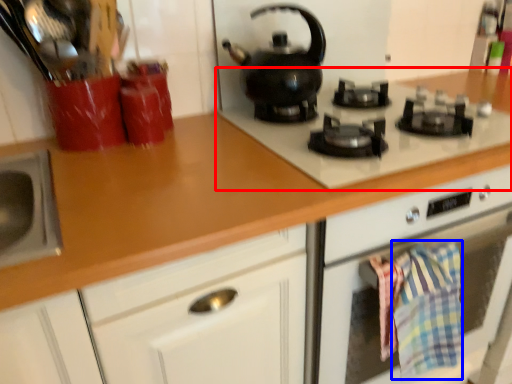
Question: Among these objects, which one is nearest to the camera, gas stove (highlighted by a red box) or blanket (highlighted by a blue box)?

Choices:
 (A) gas stove
 (B) blanket

Answer: (A)